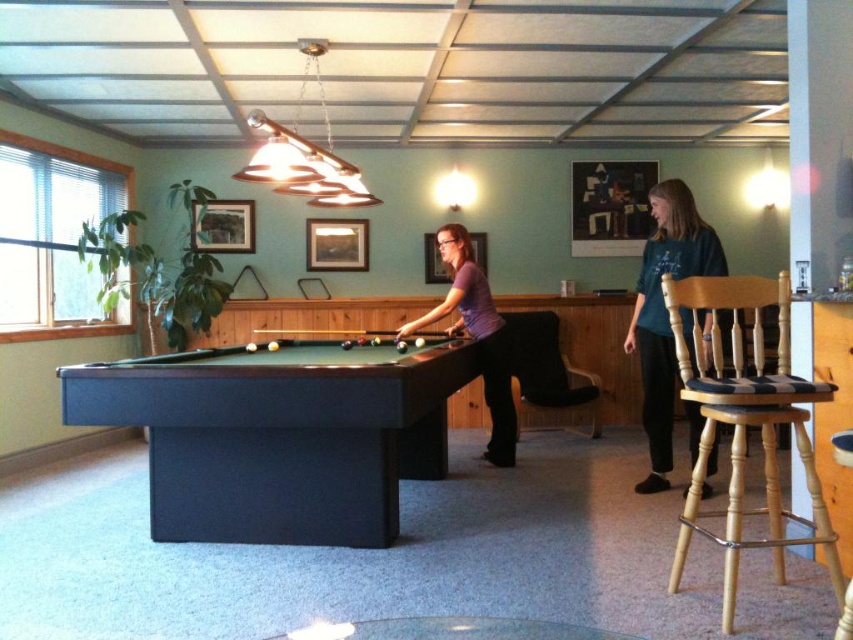
Question: Considering the real-world distances, which object is closest to the purple matte shirt at center?

Choices:
 (A) teal fabric shirt at right
 (B) light wood/checked fabric bar stool at right
 (C) dark green felt pool table at center

Answer: (C)

Question: Is teal fabric shirt at right below purple matte shirt at center?

Choices:
 (A) yes
 (B) no

Answer: (B)

Question: Which is nearer to the teal fabric shirt at right?

Choices:
 (A) light wood/checked fabric bar stool at right
 (B) dark green felt pool table at center
 (C) purple matte shirt at center

Answer: (A)

Question: Can you confirm if dark green felt pool table at center is wider than teal fabric shirt at right?

Choices:
 (A) no
 (B) yes

Answer: (B)

Question: Is light wood/checked fabric bar stool at right smaller than purple matte shirt at center?

Choices:
 (A) no
 (B) yes

Answer: (A)

Question: Which object is farther from the camera taking this photo?

Choices:
 (A) teal fabric shirt at right
 (B) light wood/checked fabric bar stool at right
 (C) purple matte shirt at center
 (D) dark green felt pool table at center

Answer: (C)